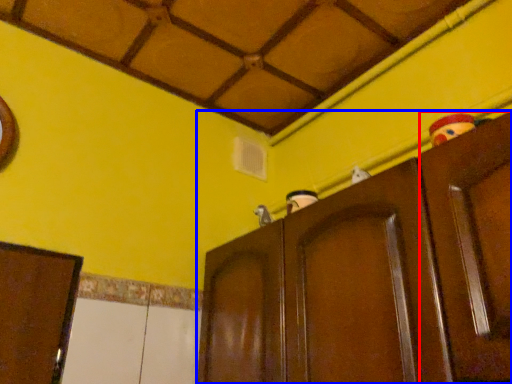
Question: Among these objects, which one is farthest to the camera, door (highlighted by a red box) or cupboard (highlighted by a blue box)?

Choices:
 (A) door
 (B) cupboard

Answer: (B)